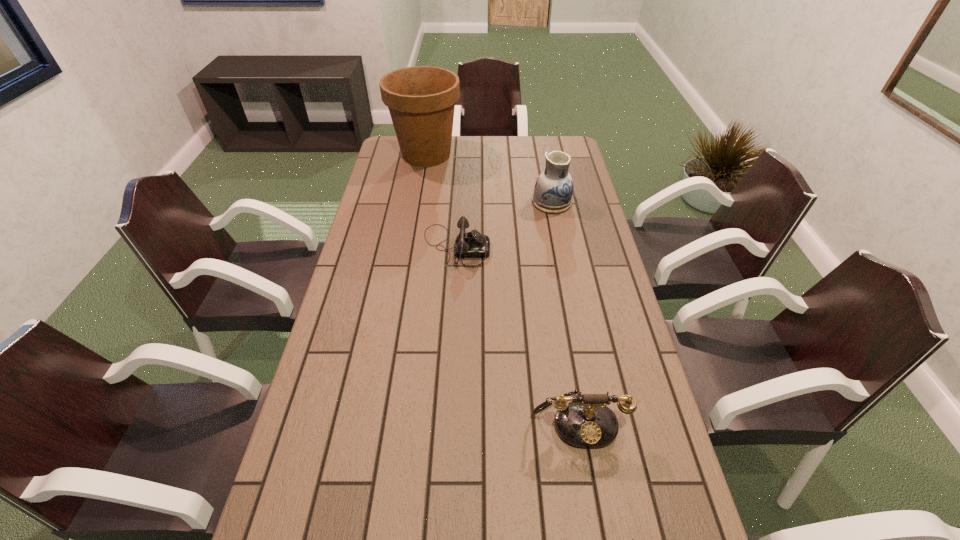
Find the location of a particular element. The height and width of the screenshot is (540, 960). the farthest object is located at coordinates [x=421, y=100].

Where is `the tallest object`? the tallest object is located at coordinates (421, 100).

The image size is (960, 540). Find the location of `pottery`. pottery is located at coordinates (553, 191).

Find the location of `the second farthest object`. the second farthest object is located at coordinates (553, 191).

The image size is (960, 540). Find the location of `the taller telephone`. the taller telephone is located at coordinates (586, 422).

You are a GUI agent. You are given a task and a screenshot of the screen. Output one action in this format:
    pyautogui.click(x=<x>, y=<y>)
    Task: Click on the right telephone
    The image size is (960, 540).
    Given the screenshot: What is the action you would take?
    pyautogui.click(x=586, y=422)

Locate an element on the screen. the second shortest object is located at coordinates (468, 244).

Image resolution: width=960 pixels, height=540 pixels. Identify the location of the left telephone. pos(468,244).

Find the location of a particular element. The height and width of the screenshot is (540, 960). vacant area situated on the front of the farthest object is located at coordinates (415, 225).

Where is `vacant space located 0.300m on the back of the fourth nearest object`? vacant space located 0.300m on the back of the fourth nearest object is located at coordinates (541, 152).